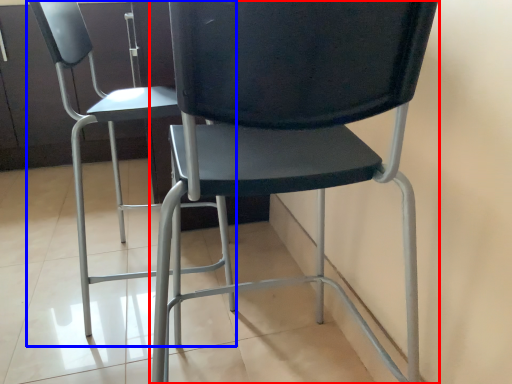
Question: Among these objects, which one is farthest to the camera, chair (highlighted by a red box) or chair (highlighted by a blue box)?

Choices:
 (A) chair
 (B) chair

Answer: (B)